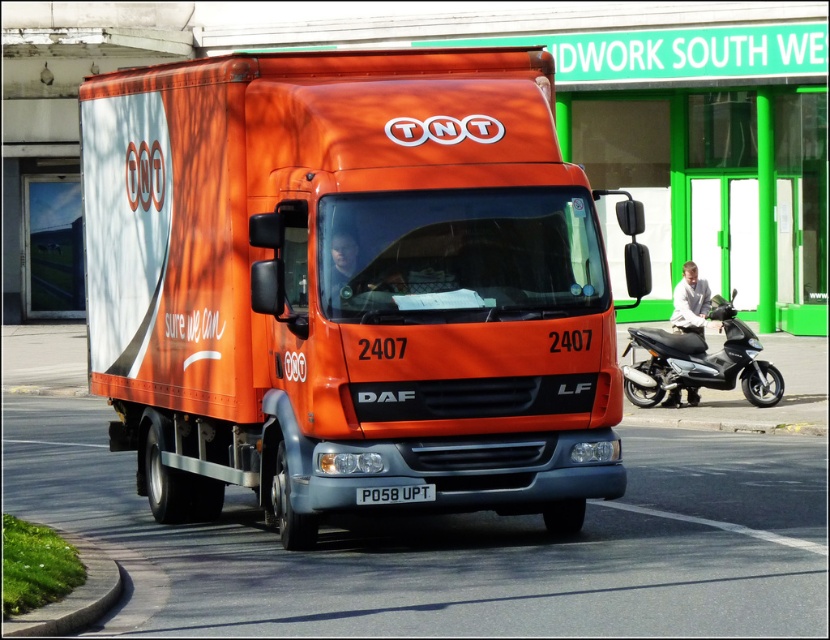
Question: Which point appears closest to the camera in this image?

Choices:
 (A) (687, 387)
 (B) (398, 492)

Answer: (B)

Question: Considering the relative positions of orange matte truck at center and black matte scooter at right in the image provided, where is orange matte truck at center located with respect to black matte scooter at right?

Choices:
 (A) below
 (B) above

Answer: (B)

Question: Which object is closer to the camera taking this photo?

Choices:
 (A) white plastic license plate at center
 (B) orange matte truck at center

Answer: (B)

Question: Which point is farther to the camera?

Choices:
 (A) black matte scooter at right
 (B) white plastic license plate at center

Answer: (A)

Question: Does orange matte truck at center lie behind white plastic license plate at center?

Choices:
 (A) no
 (B) yes

Answer: (A)

Question: Can you confirm if black matte scooter at right is thinner than white plastic license plate at center?

Choices:
 (A) yes
 (B) no

Answer: (B)